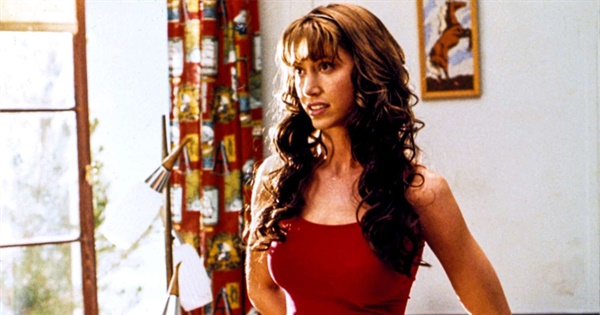
At what (x,y) coordinates should I click in order to perform the action: click on windows. Please return your answer as a coordinate pair (x, y). This screenshot has width=600, height=315. Looking at the image, I should click on (32, 198), (55, 272), (43, 83).